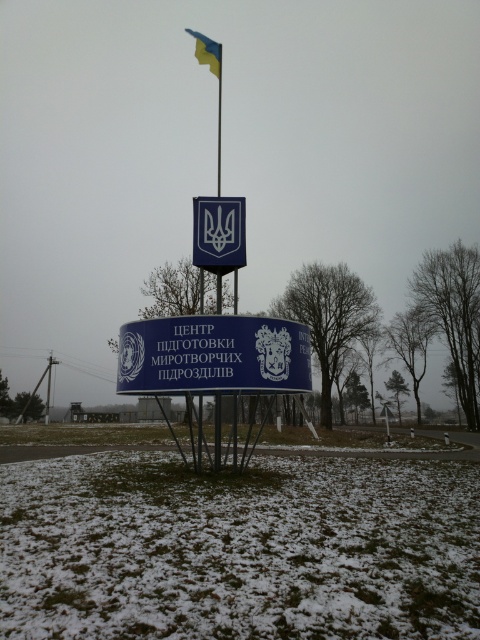
Does blue plastic sign at center appear over blue matte sign at center?

No, blue plastic sign at center is not above blue matte sign at center.

Is blue plastic sign at center positioned behind blue matte sign at center?

No, blue plastic sign at center is closer to the viewer.

Measure the distance between point [254,360] and camera.

The distance of point [254,360] from camera is 36.26 feet.

Locate an element on the screen. Image resolution: width=480 pixels, height=640 pixels. blue plastic sign at center is located at coordinates [x=213, y=355].

Who is more distant from viewer, (211, 256) or (193, 35)?

The point (193, 35) is more distant.

Measure the distance between blue matte sign at center and blue fabric flag at upper center.

The distance of blue matte sign at center from blue fabric flag at upper center is 11.70 meters.

Locate an element on the screen. The width and height of the screenshot is (480, 640). blue matte sign at center is located at coordinates (218, 234).

Can you confirm if blue plastic sign at center is positioned to the left of blue fabric flag at upper center?

Incorrect, blue plastic sign at center is not on the left side of blue fabric flag at upper center.

Does blue plastic sign at center have a smaller size compared to blue fabric flag at upper center?

Yes.

Between point (282, 360) and point (211, 44), which one is positioned in front?

Point (282, 360) is in front.

I want to click on blue plastic sign at center, so click(x=213, y=355).